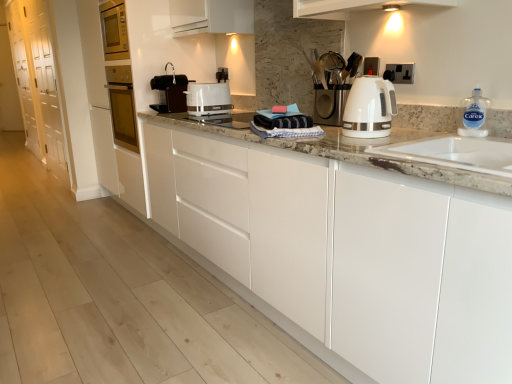
Question: Looking at their shapes, would you say clear plastic bottle at right is wider or thinner than black plastic coffee machine at center, which is the second home appliance from bottom to top?

Choices:
 (A) wide
 (B) thin

Answer: (B)

Question: From their relative heights in the image, would you say clear plastic bottle at right is taller or shorter than black plastic coffee machine at center, which is counted as the first home appliance, starting from the left?

Choices:
 (A) tall
 (B) short

Answer: (B)

Question: Estimate the real-world distances between objects in this image. Which object is closer to the clear plastic bottle at right?

Choices:
 (A) white marble sink at right
 (B) white glossy cabinets at center, marked as the second cabinetry in a left-to-right arrangement
 (C) black plastic coffee machine at center, which is counted as the second home appliance, starting from the right
 (D) black plastic electric outlet at upper right
 (E) white glossy toaster at center

Answer: (A)

Question: Which is farther from the white glossy cabinet at left, placed as the first cabinetry when sorted from back to front?

Choices:
 (A) white glossy electric kettle at right, which appears as the 2th home appliance when viewed from the top
 (B) black plastic electric outlet at upper right
 (C) black plastic coffee machine at center, which ranks as the first home appliance in top-to-bottom order
 (D) clear plastic bottle at right
 (E) white glossy toaster at center

Answer: (D)